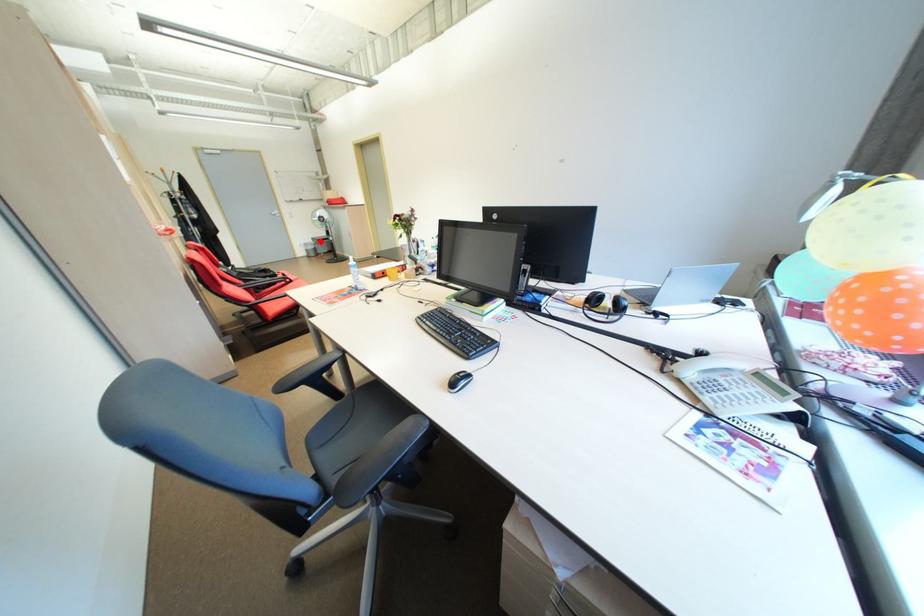
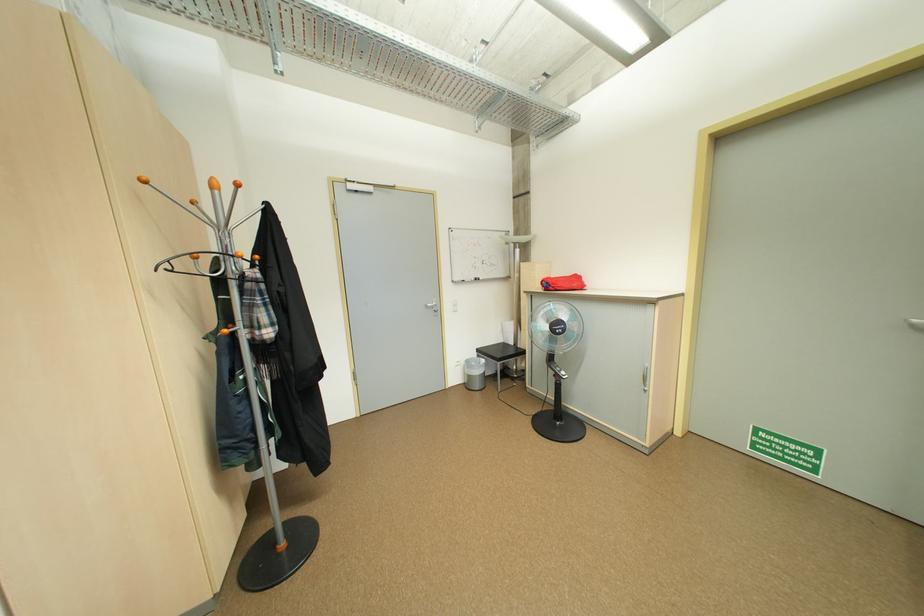
Locate, in the second image, the point that corresponds to the highlighted location in the first image.

(483, 355)